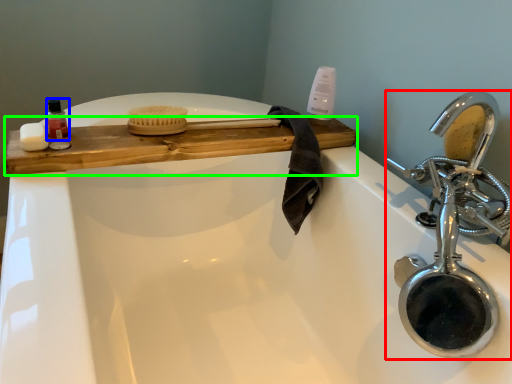
Question: Considering the real-world distances, which object is closest to tap (highlighted by a red box)? mouthwash (highlighted by a blue box) or counter (highlighted by a green box).

Choices:
 (A) mouthwash
 (B) counter

Answer: (B)